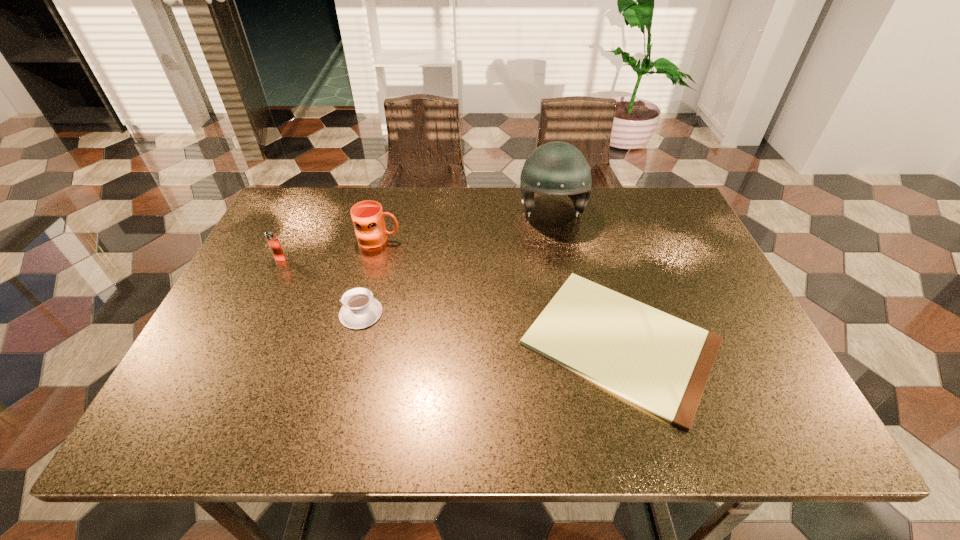
Identify the location of vacant space located 0.230m on the handle side of the teacup. (242, 313).

You are a GUI agent. You are given a task and a screenshot of the screen. Output one action in this format:
    pyautogui.click(x=<x>, y=<y>)
    Task: Click on the vacant space situated 0.230m on the handle side of the teacup
    This screenshot has width=960, height=540.
    Given the screenshot: What is the action you would take?
    pyautogui.click(x=242, y=313)

The width and height of the screenshot is (960, 540). Identify the location of blank space located 0.150m on the back of the clipboard. (591, 239).

Image resolution: width=960 pixels, height=540 pixels. In order to click on football helmet located in the far edge section of the desktop in this screenshot , I will do `click(556, 168)`.

Identify the location of mug at the far edge. The height and width of the screenshot is (540, 960). (367, 216).

Locate an element on the screen. object located at the near edge is located at coordinates (661, 363).

This screenshot has height=540, width=960. I want to click on object that is at the left edge, so click(x=272, y=239).

Find the location of a particular element. This screenshot has height=540, width=960. object that is at the right edge is located at coordinates (661, 363).

Locate an element on the screen. The height and width of the screenshot is (540, 960). object at the near right corner is located at coordinates (661, 363).

Image resolution: width=960 pixels, height=540 pixels. I want to click on vacant region at the far edge of the desktop, so [419, 195].